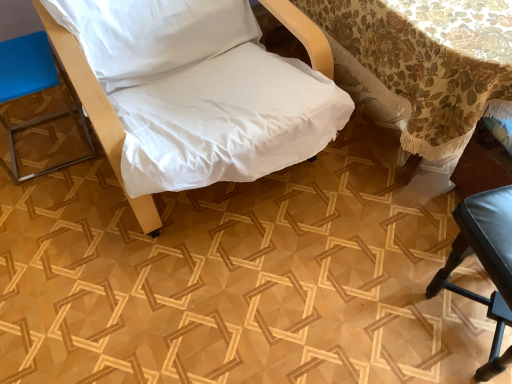
This screenshot has height=384, width=512. I want to click on vacant space that's between black leather chair at lower right, placed as the third furniture when sorted from left to right, and white fabric chair at center, which is counted as the 2th furniture, starting from the left, so [x=327, y=278].